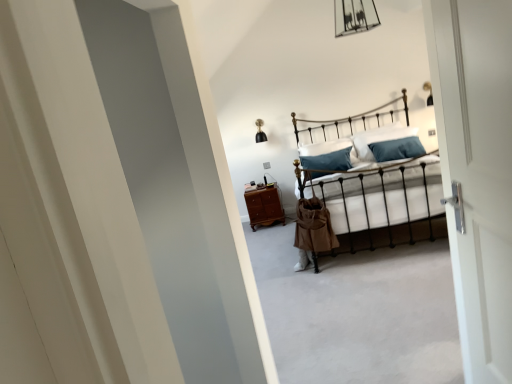
Question: Is metallic iron bed at center facing away from white soft pillow at center, which is the 1th pillow in left-to-right order?

Choices:
 (A) no
 (B) yes

Answer: (B)

Question: From the image's perspective, would you say metallic iron bed at center is shown under white soft pillow at center, which is counted as the second pillow, starting from the right?

Choices:
 (A) yes
 (B) no

Answer: (A)

Question: Is the position of metallic iron bed at center less distant than that of white soft pillow at center, which is the 1th pillow in left-to-right order?

Choices:
 (A) yes
 (B) no

Answer: (A)

Question: Does metallic iron bed at center have a larger size compared to white soft pillow at center, which is counted as the second pillow, starting from the right?

Choices:
 (A) yes
 (B) no

Answer: (A)

Question: Is metallic iron bed at center further to camera compared to white soft pillow at center, which is counted as the second pillow, starting from the right?

Choices:
 (A) no
 (B) yes

Answer: (A)

Question: From a real-world perspective, is white soft pillow at center, which is counted as the second pillow, starting from the right, positioned above or below brown wooden nightstand at center?

Choices:
 (A) above
 (B) below

Answer: (A)

Question: Considering the positions of point (313, 147) and point (265, 211), is point (313, 147) closer or farther from the camera than point (265, 211)?

Choices:
 (A) closer
 (B) farther

Answer: (B)

Question: From the image's perspective, is white soft pillow at center, which is counted as the second pillow, starting from the right, positioned above or below brown wooden nightstand at center?

Choices:
 (A) below
 (B) above

Answer: (B)

Question: Considering the positions of white soft pillow at center, which is counted as the second pillow, starting from the right, and brown wooden nightstand at center in the image, is white soft pillow at center, which is counted as the second pillow, starting from the right, taller or shorter than brown wooden nightstand at center?

Choices:
 (A) tall
 (B) short

Answer: (B)

Question: Is white soft pillow at center, which is the 1th pillow in left-to-right order, wider or thinner than white soft pillow at center, the 1th pillow viewed from the right?

Choices:
 (A) wide
 (B) thin

Answer: (B)

Question: Is white soft pillow at center, which is the 1th pillow in left-to-right order, spatially inside white soft pillow at center, acting as the 2th pillow starting from the left, or outside of it?

Choices:
 (A) outside
 (B) inside

Answer: (A)

Question: From a real-world perspective, is white soft pillow at center, which is counted as the second pillow, starting from the right, physically located above or below white soft pillow at center, the 1th pillow viewed from the right?

Choices:
 (A) above
 (B) below

Answer: (B)

Question: Would you say white soft pillow at center, which is counted as the second pillow, starting from the right, is to the left or to the right of white soft pillow at center, the 1th pillow viewed from the right, in the picture?

Choices:
 (A) right
 (B) left

Answer: (B)

Question: Is point (263, 208) positioned closer to the camera than point (309, 173)?

Choices:
 (A) closer
 (B) farther

Answer: (B)

Question: Based on their sizes in the image, would you say brown wooden nightstand at center is bigger or smaller than metallic iron bed at center?

Choices:
 (A) small
 (B) big

Answer: (A)